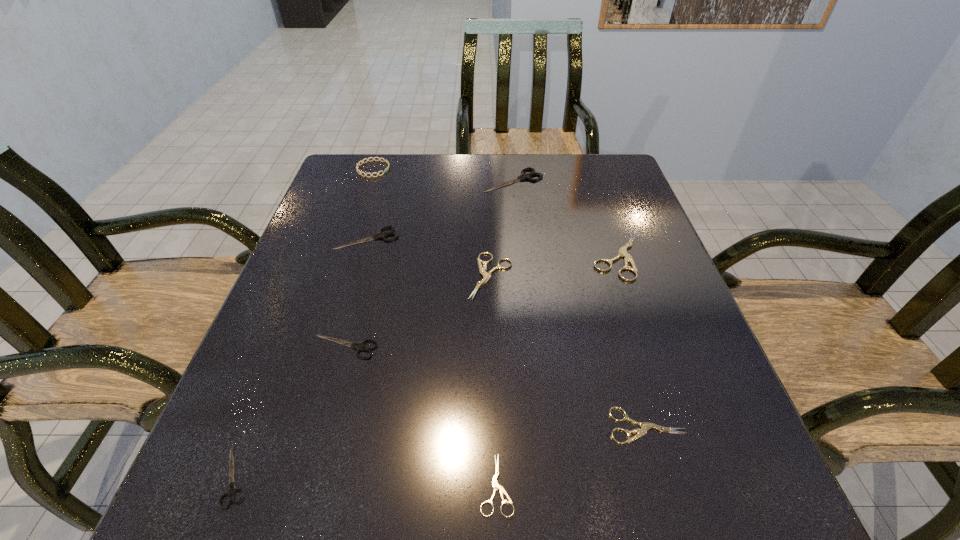
Locate an element on the screen. This screenshot has height=540, width=960. the tallest object is located at coordinates (379, 159).

Locate an element on the screen. The width and height of the screenshot is (960, 540). blue bracelet is located at coordinates (379, 159).

You are a GUI agent. You are given a task and a screenshot of the screen. Output one action in this format:
    pyautogui.click(x=<x>, y=<y>)
    Task: Click on the rightmost black shears
    
    Given the screenshot: What is the action you would take?
    pyautogui.click(x=523, y=176)

Where is `the eighth shortest object`? Image resolution: width=960 pixels, height=540 pixels. the eighth shortest object is located at coordinates (523, 176).

Identify the location of the second biggest black shears. (380, 235).

Where is `the biggest beige shears`? the biggest beige shears is located at coordinates (622, 252).

In order to click on the sixth farthest object in this screenshot , I will do `click(361, 346)`.

You are a GUI agent. You are given a task and a screenshot of the screen. Output one action in this format:
    pyautogui.click(x=<x>, y=<y>)
    Task: Click on the fifth farthest shears
    
    Given the screenshot: What is the action you would take?
    pyautogui.click(x=361, y=346)

What are the coordinates of `the second biggest beige shears` in the screenshot? It's located at (486, 276).

Find the location of a particular element. The width and height of the screenshot is (960, 540). the third farthest beige shears is located at coordinates (645, 426).